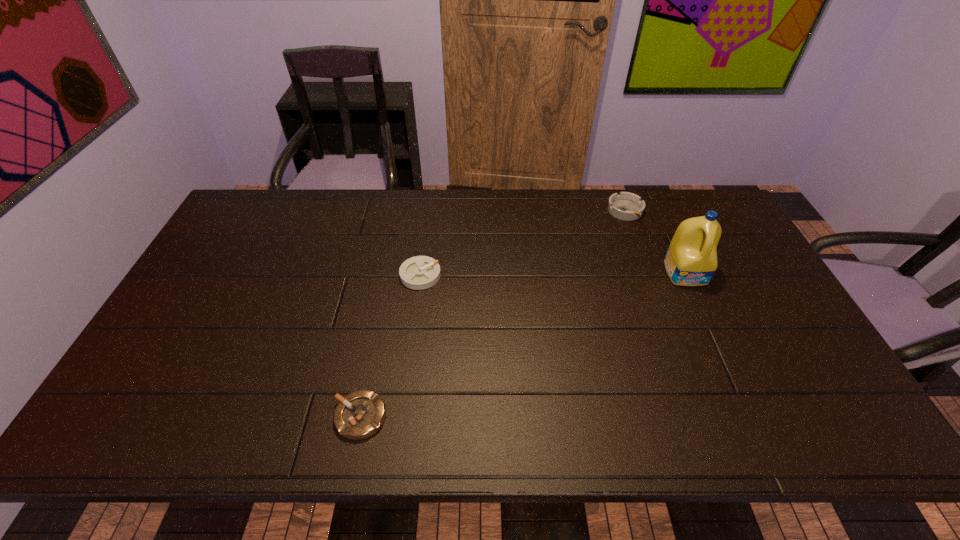
Find the location of `the tallest object`. the tallest object is located at coordinates (691, 260).

Find the location of a particular element. The width and height of the screenshot is (960, 540). the farthest ashtray is located at coordinates (627, 206).

Find the location of a particular element. Image resolution: width=960 pixels, height=540 pixels. the farthest object is located at coordinates (627, 206).

Where is `the second farthest ashtray`? the second farthest ashtray is located at coordinates (420, 272).

Where is `the nearest object`? The width and height of the screenshot is (960, 540). the nearest object is located at coordinates (360, 414).

Image resolution: width=960 pixels, height=540 pixels. Identify the location of free space located 0.090m on the label of the tallest object. (703, 311).

Identify the location of vacant region located on the left of the tallest ashtray. coord(499,211).

What are the coordinates of `vacant point located on the right of the second nearest ashtray` in the screenshot? It's located at (464, 275).

At what (x,y) coordinates should I click in order to perform the action: click on vacant space located 0.230m on the back of the nearest ashtray. Please return your answer as a coordinate pair (x, y). The image size is (960, 540). Looking at the image, I should click on (x=380, y=318).

Where is `object located at the far edge`? The image size is (960, 540). object located at the far edge is located at coordinates (627, 206).